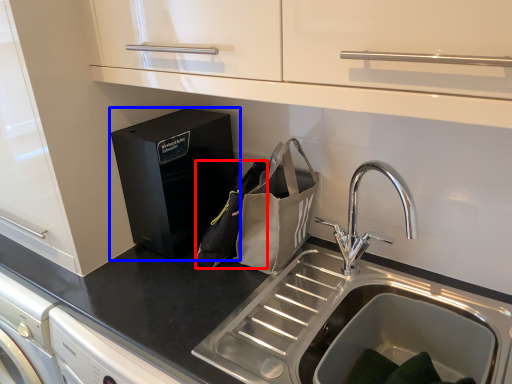
Question: Which point is further to the camera, pouch (highlighted by a red box) or home appliance (highlighted by a blue box)?

Choices:
 (A) pouch
 (B) home appliance

Answer: (B)